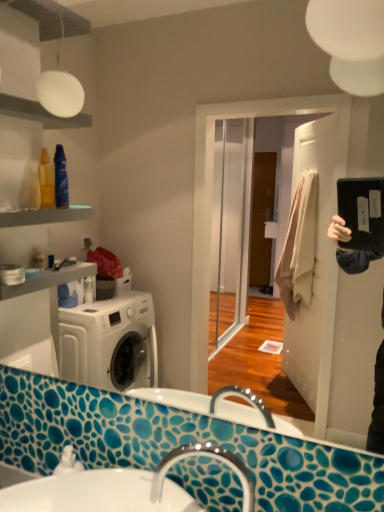
This screenshot has width=384, height=512. What are the coordinates of `white glossy sink at lower center` in the screenshot? It's located at (123, 487).

The height and width of the screenshot is (512, 384). What do you see at coordinates (210, 457) in the screenshot? I see `silver metallic faucet at lower center` at bounding box center [210, 457].

The image size is (384, 512). Describe the element at coordinates (315, 262) in the screenshot. I see `matte black mirror at upper right` at that location.

What are the coordinates of `white glossy sink at lower center` in the screenshot? It's located at (123, 487).

Does white glossy sink at lower center have a lesser width compared to matte black mirror at upper right?

In fact, white glossy sink at lower center might be wider than matte black mirror at upper right.

Can matte black mirror at upper right be found inside white glossy sink at lower center?

No, matte black mirror at upper right is not inside white glossy sink at lower center.

From the picture: Considering the relative positions of white glossy sink at lower center and matte black mirror at upper right in the image provided, is white glossy sink at lower center to the left of matte black mirror at upper right from the viewer's perspective?

Answer: Yes, white glossy sink at lower center is to the left of matte black mirror at upper right.

How many degrees apart are the facing directions of silver metallic faucet at lower center and matte black mirror at upper right?

The facing directions of silver metallic faucet at lower center and matte black mirror at upper right are 71.7 degrees apart.

Is silver metallic faucet at lower center oriented towards matte black mirror at upper right?

No, silver metallic faucet at lower center does not turn towards matte black mirror at upper right.

Which is behind, silver metallic faucet at lower center or matte black mirror at upper right?

silver metallic faucet at lower center.

Where is `mirror located in front of the silver metallic faucet at lower center`? The height and width of the screenshot is (512, 384). mirror located in front of the silver metallic faucet at lower center is located at coordinates (315, 262).

From the image's perspective, does matte black mirror at upper right appear lower than white glossy sink at lower center?

No.

Is white glossy sink at lower center inside matte black mirror at upper right?

No, white glossy sink at lower center is not surrounded by matte black mirror at upper right.

Considering the points (289, 354) and (26, 489), which point is in front, point (289, 354) or point (26, 489)?

The point (26, 489) is in front.

Can you tell me how much matte black mirror at upper right and white glossy sink at lower center differ in facing direction?

They differ by 0.000323 degrees in their facing directions.

Are matte black mirror at upper right and silver metallic faucet at lower center located far from each other?

Yes, matte black mirror at upper right and silver metallic faucet at lower center are located far from each other.

Does matte black mirror at upper right have a smaller size compared to silver metallic faucet at lower center?

Incorrect, matte black mirror at upper right is not smaller in size than silver metallic faucet at lower center.

Is matte black mirror at upper right facing away from silver metallic faucet at lower center?

No.

From the image's perspective, would you say white glossy sink at lower center is positioned over silver metallic faucet at lower center?

No.

Can you confirm if white glossy sink at lower center is wider than silver metallic faucet at lower center?

Correct, the width of white glossy sink at lower center exceeds that of silver metallic faucet at lower center.

How many degrees apart are the facing directions of white glossy sink at lower center and silver metallic faucet at lower center?

71.7 degrees.

How distant is white glossy sink at lower center from silver metallic faucet at lower center?

2.87 inches.

Who is taller, silver metallic faucet at lower center or white glossy sink at lower center?

With more height is silver metallic faucet at lower center.

Is silver metallic faucet at lower center smaller than white glossy sink at lower center?

Yes, silver metallic faucet at lower center is smaller than white glossy sink at lower center.

From the picture: From a real-world perspective, is silver metallic faucet at lower center above or below white glossy sink at lower center?

From a real-world perspective, silver metallic faucet at lower center is physically above white glossy sink at lower center.

Locate an element on the screen. The height and width of the screenshot is (512, 384). mirror in front of the white glossy sink at lower center is located at coordinates (315, 262).

Identify the location of mirror lying on the left of silver metallic faucet at lower center. (315, 262).

Estimate the real-world distances between objects in this image. Which object is closer to white glossy sink at lower center, silver metallic faucet at lower center or matte black mirror at upper right?

silver metallic faucet at lower center.

Looking at the image, which one is located closer to matte black mirror at upper right, white glossy sink at lower center or silver metallic faucet at lower center?

white glossy sink at lower center lies closer to matte black mirror at upper right than the other object.

From the image, which object appears to be nearer to matte black mirror at upper right, silver metallic faucet at lower center or white glossy sink at lower center?

Among the two, white glossy sink at lower center is located nearer to matte black mirror at upper right.

Consider the image. Estimate the real-world distances between objects in this image. Which object is closer to white glossy sink at lower center, matte black mirror at upper right or silver metallic faucet at lower center?

The object closer to white glossy sink at lower center is silver metallic faucet at lower center.

From the picture: Estimate the real-world distances between objects in this image. Which object is further from silver metallic faucet at lower center, matte black mirror at upper right or white glossy sink at lower center?

matte black mirror at upper right.

Based on their spatial positions, is white glossy sink at lower center or matte black mirror at upper right closer to silver metallic faucet at lower center?

white glossy sink at lower center lies closer to silver metallic faucet at lower center than the other object.

This screenshot has width=384, height=512. Identify the location of tap between matte black mirror at upper right and white glossy sink at lower center in the up-down direction. (210, 457).